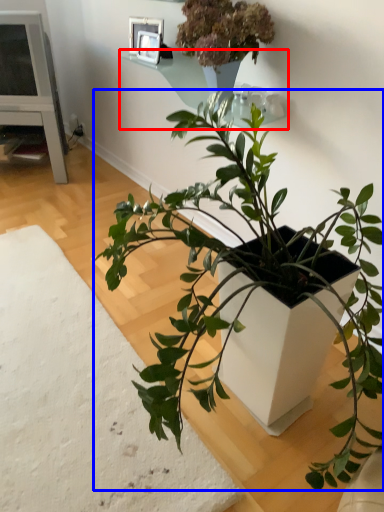
Question: Among these objects, which one is farthest to the camera, window sill (highlighted by a red box) or houseplant (highlighted by a blue box)?

Choices:
 (A) window sill
 (B) houseplant

Answer: (A)